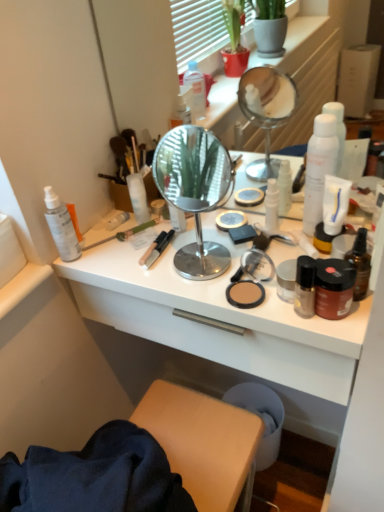
Locate an element on the screen. This screenshot has width=384, height=512. free space that is in between translucent plastic spray bottle at left, which is the eighth toiletry in right-to-left order, and white glossy bottle at center, the 5th toiletry viewed from the left is located at coordinates (160, 244).